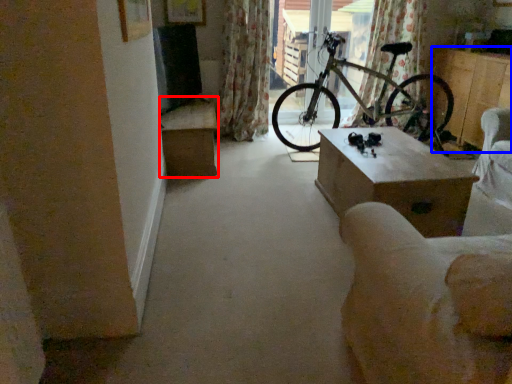
Question: Which object appears closest to the camera in this image, table (highlighted by a red box) or furniture (highlighted by a blue box)?

Choices:
 (A) table
 (B) furniture

Answer: (A)